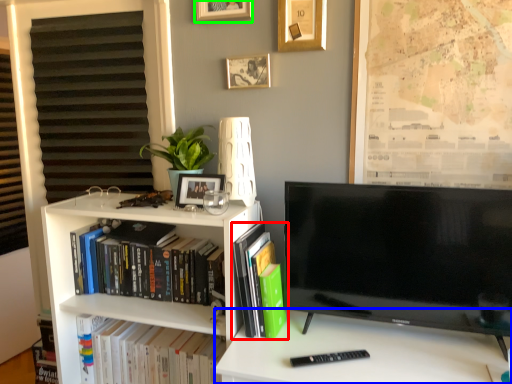
Question: Which object is the closest to the book (highlighted by a red box)? Choose among these: desk (highlighted by a blue box) or picture frame (highlighted by a green box).

Choices:
 (A) desk
 (B) picture frame

Answer: (A)